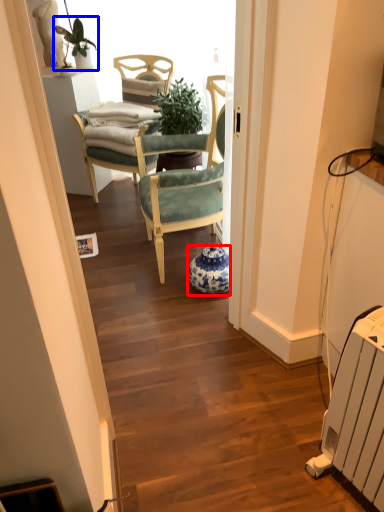
Question: Which of the following is the closest to the observer, vase (highlighted by a red box) or houseplant (highlighted by a blue box)?

Choices:
 (A) vase
 (B) houseplant

Answer: (A)